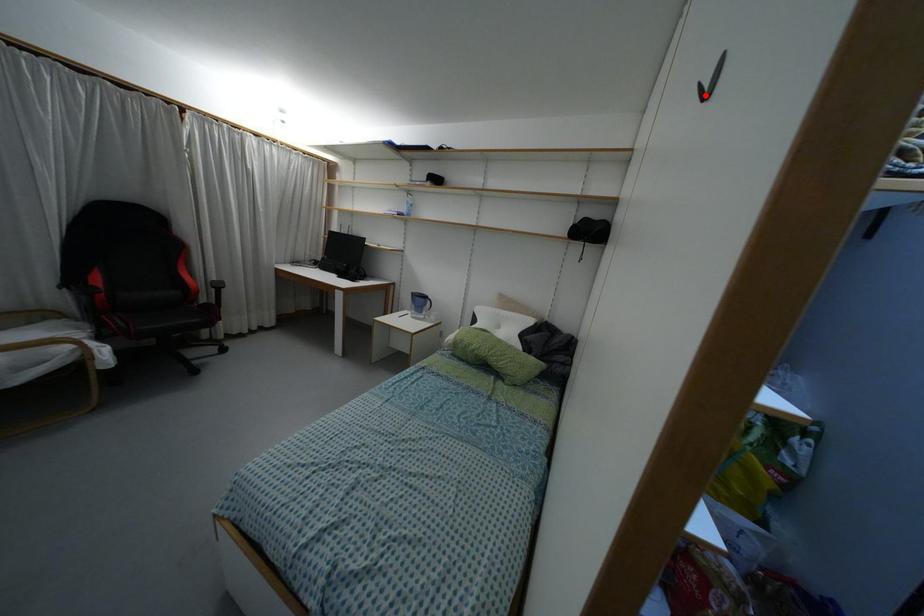
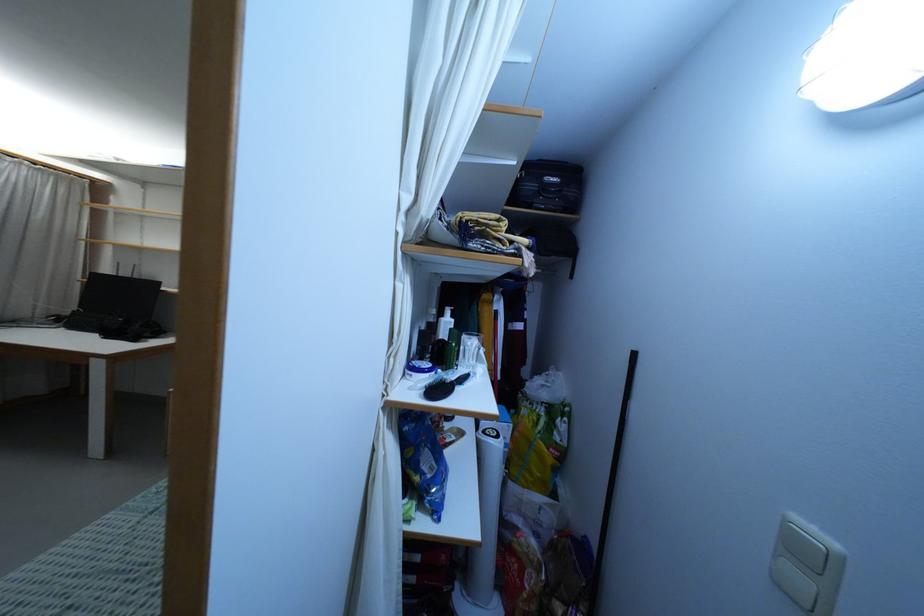
Question: I am providing you with two images of the same scene from different viewpoints. A red point is marked on the first image. Is the red point's position out of view in image 2?

Choices:
 (A) Yes
 (B) No

Answer: (A)